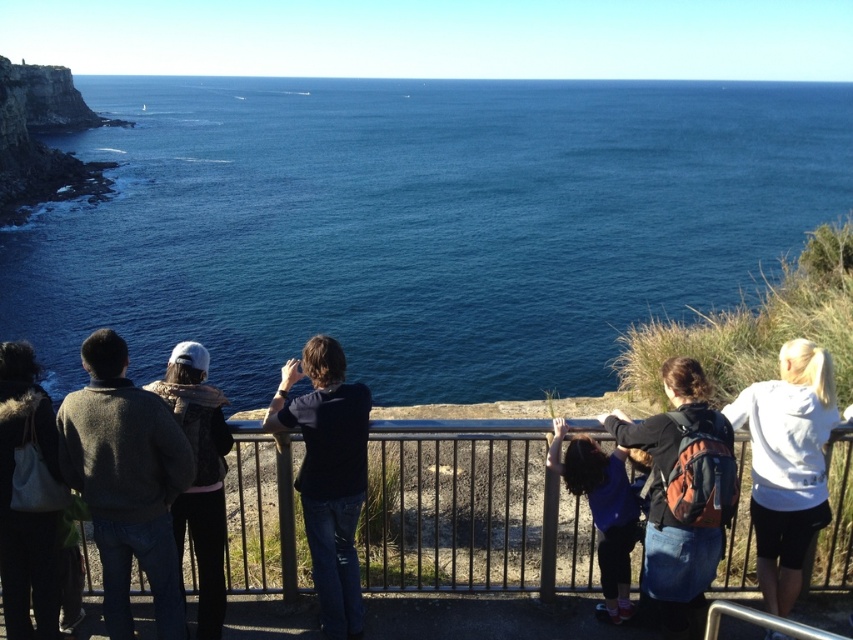
Which is below, blue water at center or dark gray sweater at left?

dark gray sweater at left is below.

The width and height of the screenshot is (853, 640). What are the coordinates of `blue water at center` in the screenshot? It's located at tap(419, 225).

Between blue water at center and blue fabric at center, which one is positioned lower?

blue fabric at center is lower down.

Consider the image. Is blue water at center below blue fabric at center?

No.

What do you see at coordinates (419, 225) in the screenshot?
I see `blue water at center` at bounding box center [419, 225].

Locate an element on the screen. blue water at center is located at coordinates (419, 225).

Based on the photo, is dark gray sweater at left bigger than dark gray sweater at center?

Yes.

Can you confirm if dark gray sweater at left is wider than dark gray sweater at center?

Indeed, dark gray sweater at left has a greater width compared to dark gray sweater at center.

Who is more forward, (140, 536) or (221, 545)?

Point (140, 536) is in front.

Find the location of `dark gray sweater at left`. dark gray sweater at left is located at coordinates [x=126, y=481].